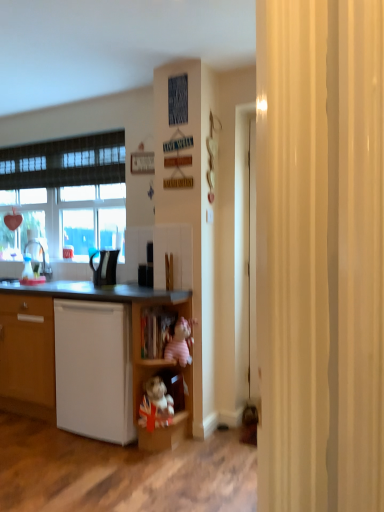
The height and width of the screenshot is (512, 384). Identify the location of vacant space in front of white matte dishwasher at lower left. (96, 459).